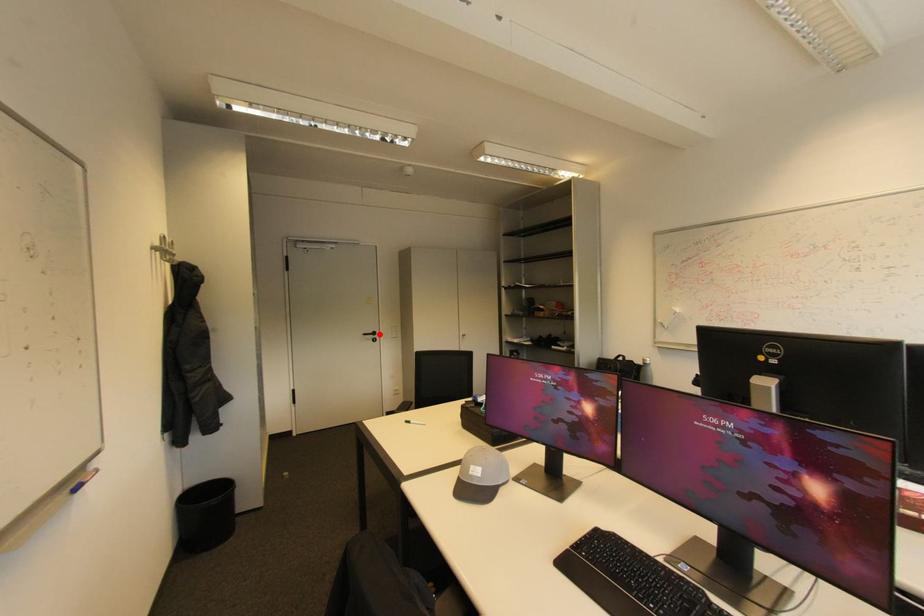
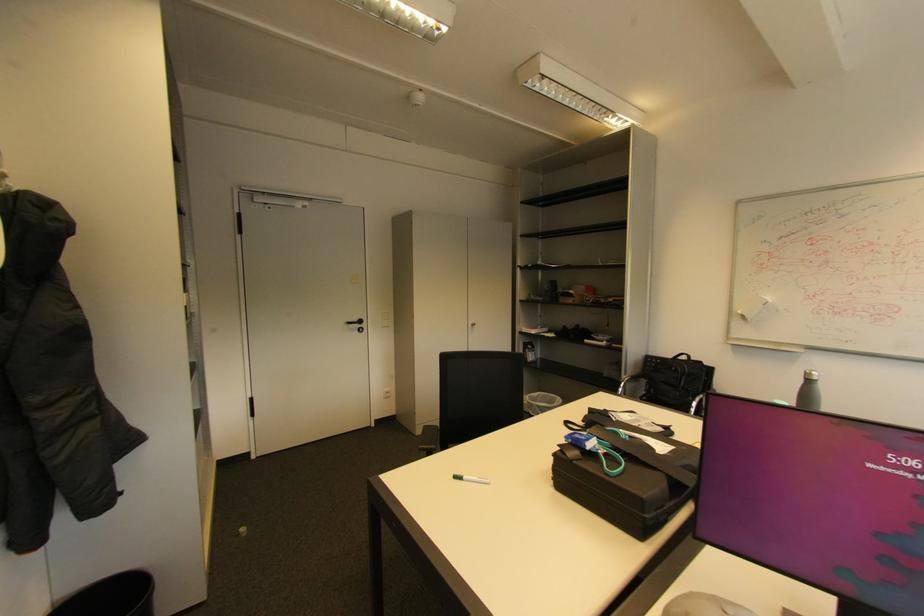
In the second image, find the point that corresponds to the highlighted location in the first image.

(366, 322)